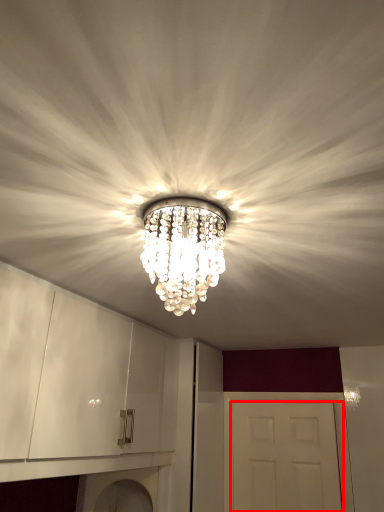
Question: Observing the image, what is the correct spatial positioning of door (annotated by the red box) in reference to lamp?

Choices:
 (A) right
 (B) left

Answer: (A)